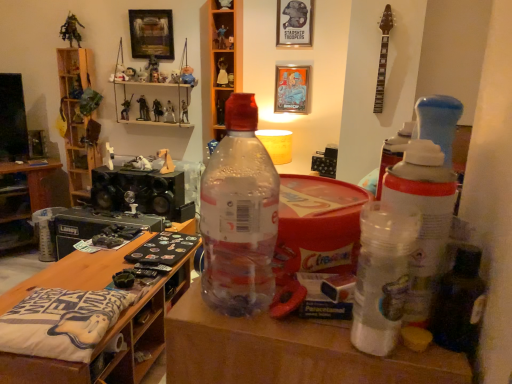
Find the location of a particular element. This screenshot has width=512, height=384. vacant location below metallic green figure at upper left, which appears as the 18th toy when viewed from the right (from a real-world perspective) is located at coordinates (73, 46).